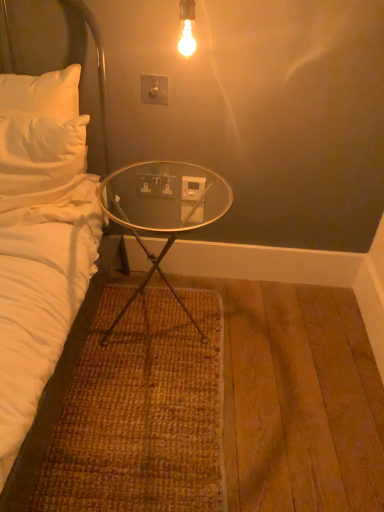
The width and height of the screenshot is (384, 512). Find the location of `free space in front of transparent glass table at center`. free space in front of transparent glass table at center is located at coordinates (158, 413).